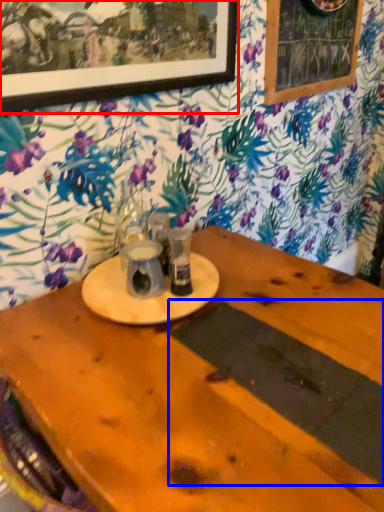
Question: Which of the following is the closest to the observer, picture frame (highlighted by a red box) or plank (highlighted by a blue box)?

Choices:
 (A) picture frame
 (B) plank

Answer: (B)